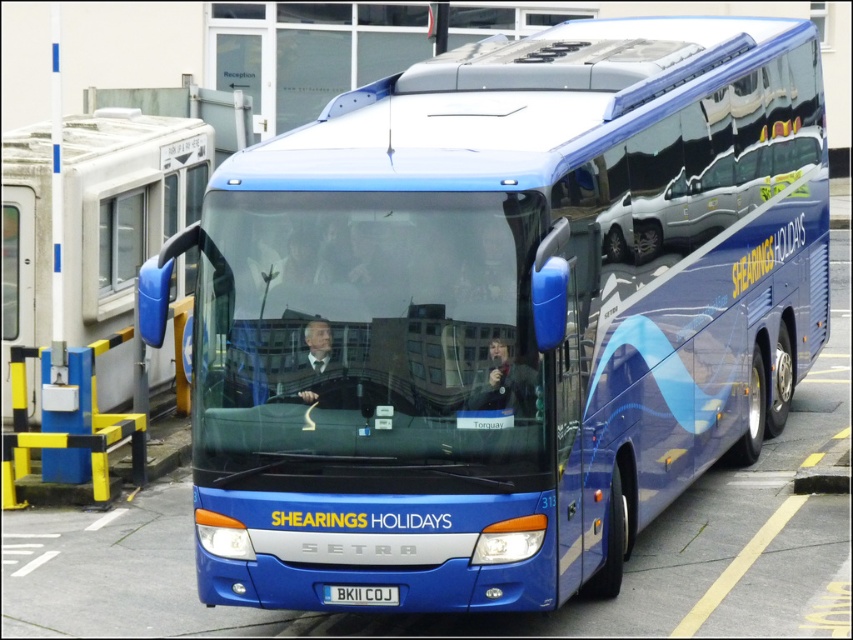
Question: Which object is the farthest from the dark blue leather jacket at center?

Choices:
 (A) blue metallic license plate at center
 (B) smooth skin face at center

Answer: (A)

Question: Which object is farther from the camera taking this photo?

Choices:
 (A) blue metallic license plate at center
 (B) smooth skin face at center
 (C) dark blue leather jacket at center

Answer: (A)

Question: Can you confirm if dark blue leather jacket at center is positioned to the left of blue metallic license plate at center?

Choices:
 (A) no
 (B) yes

Answer: (A)

Question: Does dark blue leather jacket at center have a greater width compared to smooth skin face at center?

Choices:
 (A) no
 (B) yes

Answer: (B)

Question: Estimate the real-world distances between objects in this image. Which object is farther from the dark blue leather jacket at center?

Choices:
 (A) smooth skin face at center
 (B) blue metallic license plate at center

Answer: (B)

Question: Does smooth skin face at center have a larger size compared to blue metallic license plate at center?

Choices:
 (A) yes
 (B) no

Answer: (A)